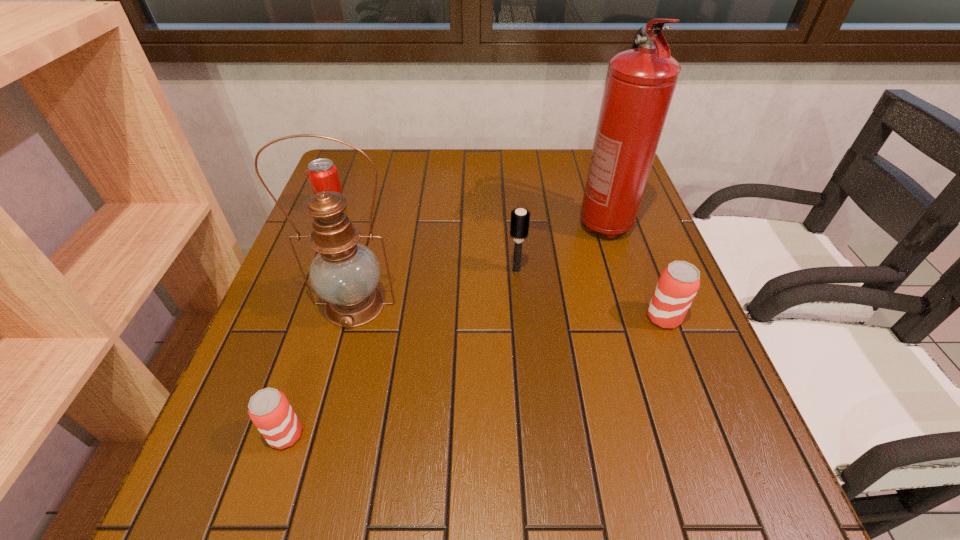
Where is `blank area in the image that satisfies the following two spatial constraints: 1. on the handle side the tallest object; 2. on the right side of the right beer can`? blank area in the image that satisfies the following two spatial constraints: 1. on the handle side the tallest object; 2. on the right side of the right beer can is located at coordinates (635, 318).